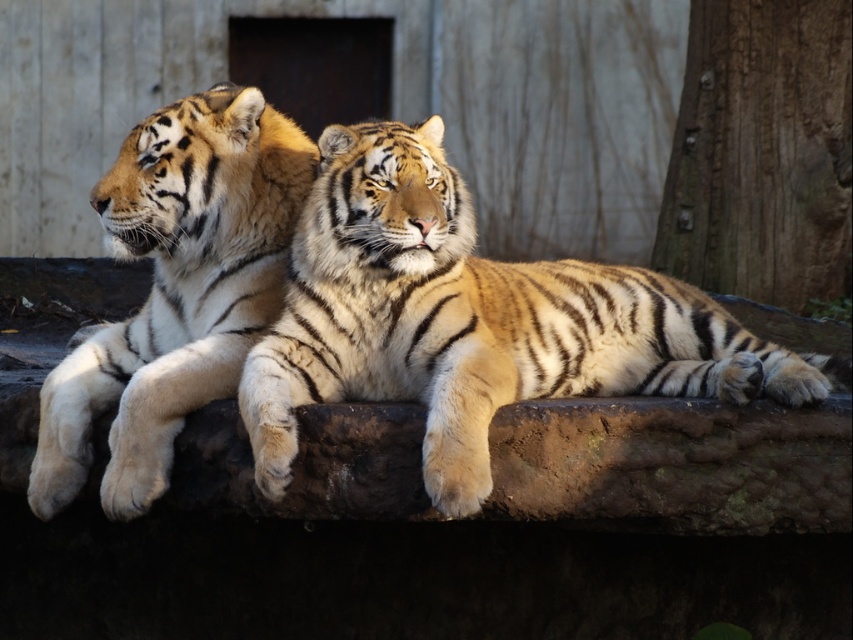
Which of these two, golden fur tiger at center or golden fur tiger at left, stands shorter?

golden fur tiger at left is shorter.

Based on the photo, measure the distance between golden fur tiger at center and camera.

A distance of 8.83 meters exists between golden fur tiger at center and camera.

You are a GUI agent. You are given a task and a screenshot of the screen. Output one action in this format:
    pyautogui.click(x=<x>, y=<y>)
    Task: Click on the golden fur tiger at center
    This screenshot has width=853, height=640.
    Given the screenshot: What is the action you would take?
    pyautogui.click(x=473, y=321)

What do you see at coordinates (473, 321) in the screenshot? I see `golden fur tiger at center` at bounding box center [473, 321].

Can you confirm if golden fur tiger at center is positioned to the right of smooth bark tree trunk at right?

Incorrect, golden fur tiger at center is not on the right side of smooth bark tree trunk at right.

Between point (270, 481) and point (802, 195), which one is positioned behind?

The point (802, 195) is behind.

Find the location of a particular element. The width and height of the screenshot is (853, 640). golden fur tiger at center is located at coordinates (473, 321).

Is golden fur tiger at left further to the viewer compared to smooth bark tree trunk at right?

No, golden fur tiger at left is in front of smooth bark tree trunk at right.

Is point (199, 260) behind point (845, 285)?

No, (199, 260) is closer to viewer.

Which is in front, point (35, 496) or point (688, 170)?

Point (35, 496) is in front.

Find the location of a particular element. The height and width of the screenshot is (640, 853). golden fur tiger at left is located at coordinates (175, 289).